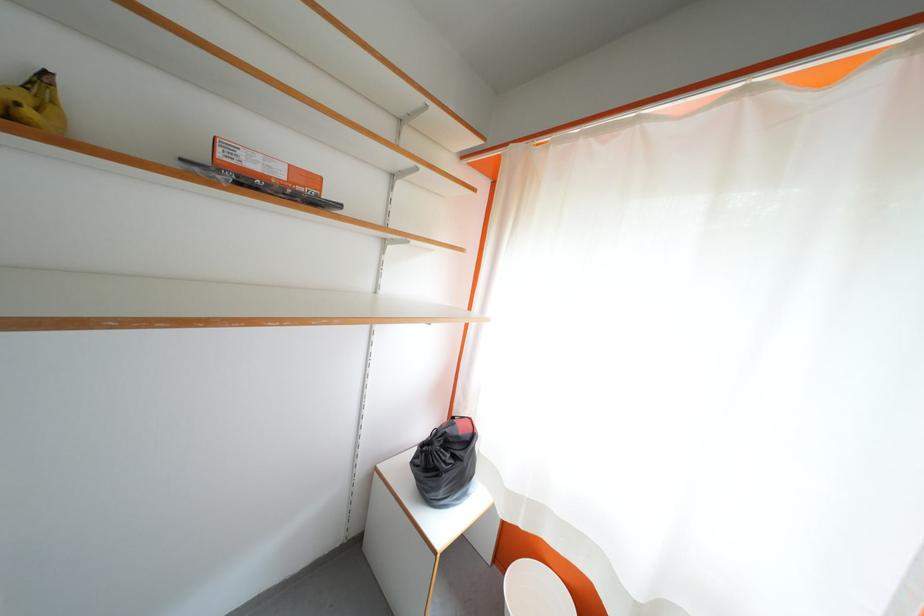
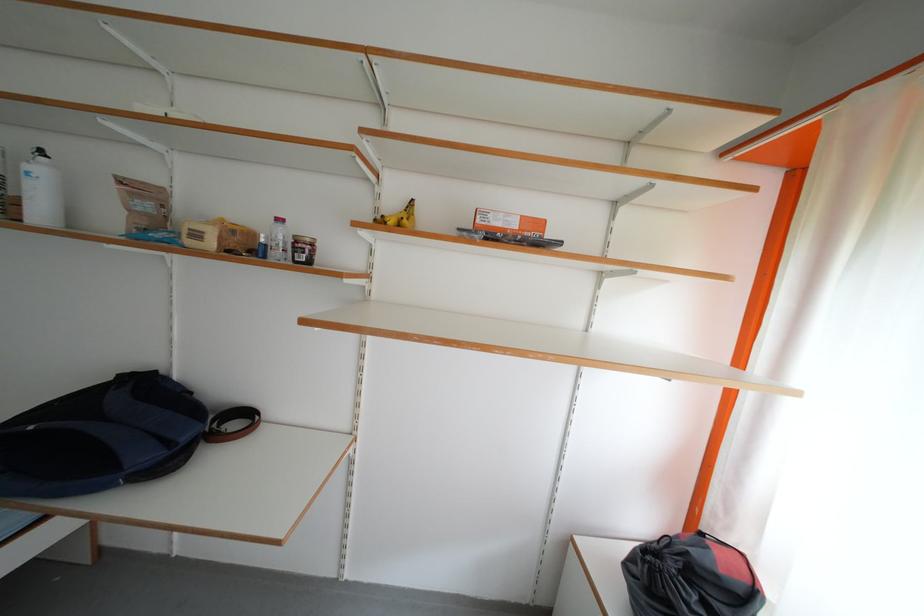
Question: The first image is from the beginning of the video and the second image is from the end. How did the camera likely rotate when shooting the video?

Choices:
 (A) Left
 (B) Right
 (C) Up
 (D) Down

Answer: (A)